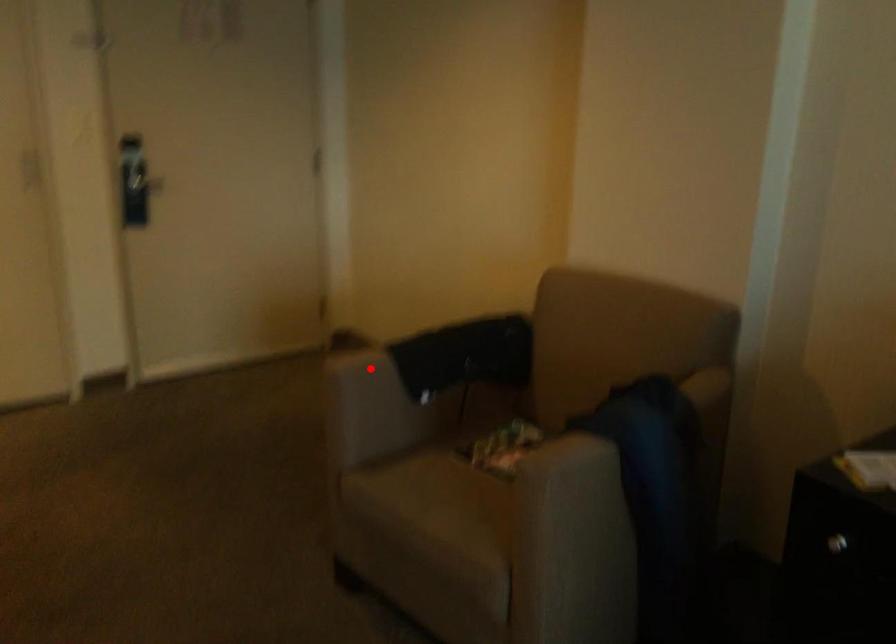
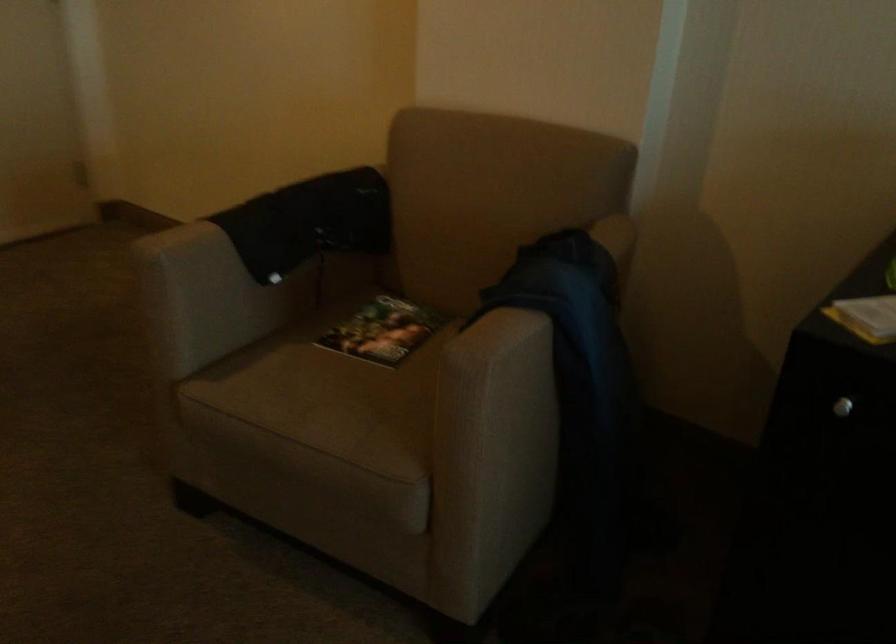
Find the pixel in the second image that matches the highlighted location in the first image.

(201, 243)